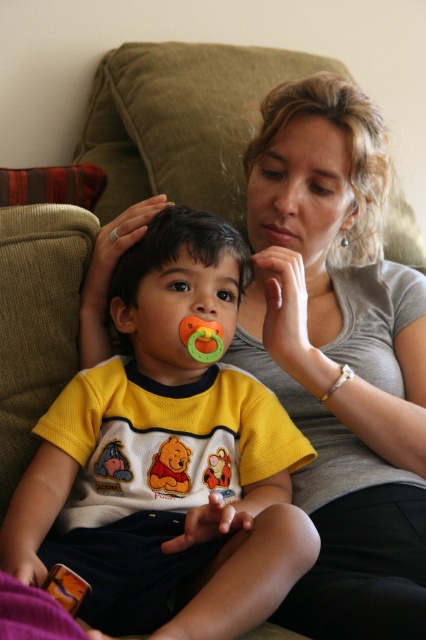
Question: Can you confirm if matte gray shirt at center is bigger than yellow cotton shirt at center?

Choices:
 (A) yes
 (B) no

Answer: (A)

Question: Which of the following is the farthest from the observer?

Choices:
 (A) yellow fabric winnie the pooh plush at center
 (B) rubber pacifier at lower left

Answer: (A)

Question: Does smooth skin mouth at center appear over yellow fabric winnie the pooh plush at center?

Choices:
 (A) no
 (B) yes

Answer: (B)

Question: Is matte gray shirt at center thinner than rubber pacifier at lower left?

Choices:
 (A) no
 (B) yes

Answer: (A)

Question: Which of the following is the farthest from the observer?

Choices:
 (A) smooth skin mouth at center
 (B) rubber/soft pacifier at center
 (C) rubber pacifier at lower left

Answer: (A)

Question: Which of the following is the closest to the observer?

Choices:
 (A) (215, 321)
 (B) (115, 240)
 (C) (256, 227)

Answer: (A)